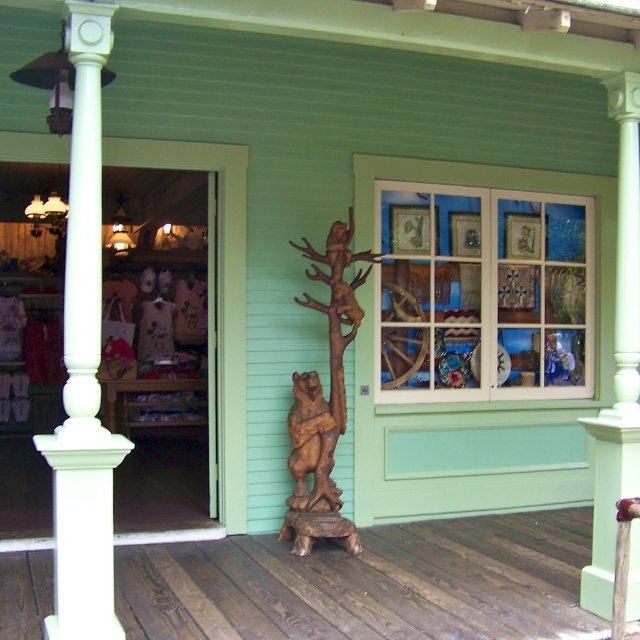
Consider the image. You are a customer entering the shop and need to sit down. There is a wooden bench at center and a white painted wood column at center. Which object can you sit on?

The wooden bench at center is not as tall as the white painted wood column at center, so the wooden bench at center is shorter and more suitable for sitting.

You are a customer entering the shop and want to sit down. The wooden bench at center and the matte glass window at center are both in your view. Which object is more suitable for sitting?

Result: The wooden bench at center is smaller than the matte glass window at center, so the wooden bench at center is more suitable for sitting since it is designed for seating.